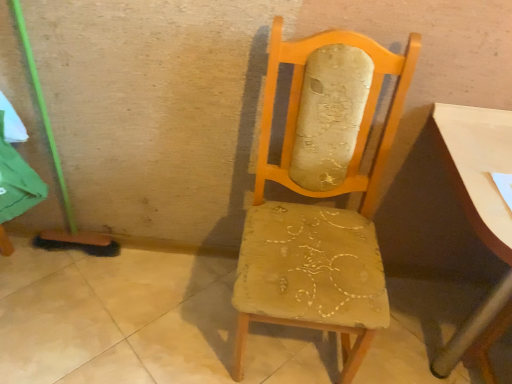
This screenshot has height=384, width=512. In order to click on vacant region under wooden upholstered chair at center (from a real-world perspective) in this screenshot , I will do `click(287, 355)`.